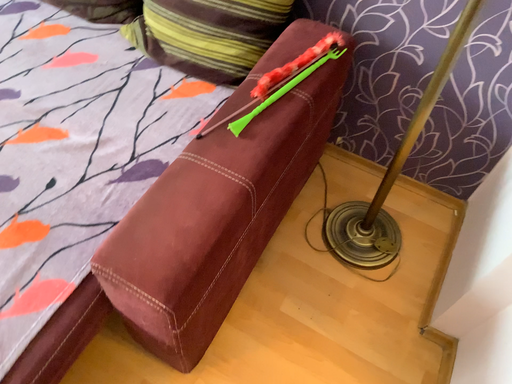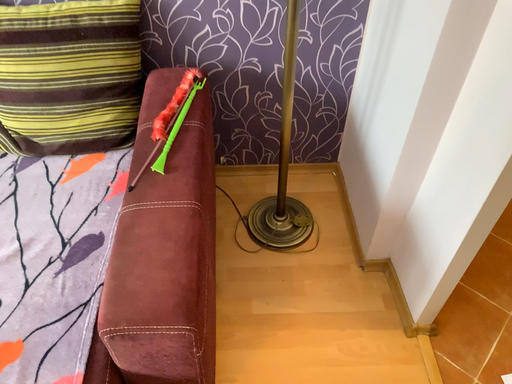
Question: Which way did the camera rotate in the video?

Choices:
 (A) rotated downward
 (B) rotated upward

Answer: (B)